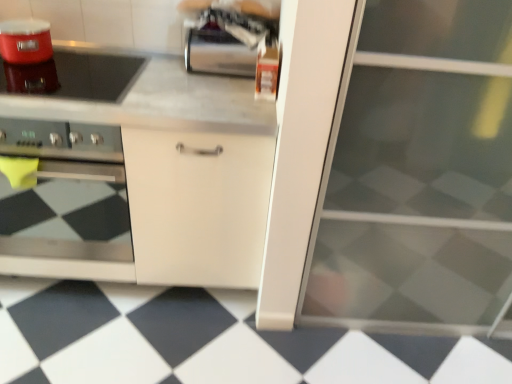
Question: In terms of width, does matte red rice cooker at upper left look wider or thinner when compared to satin metallic paper towel holder at upper center?

Choices:
 (A) thin
 (B) wide

Answer: (B)

Question: In terms of height, does matte red rice cooker at upper left look taller or shorter compared to satin metallic paper towel holder at upper center?

Choices:
 (A) tall
 (B) short

Answer: (B)

Question: Estimate the real-world distances between objects in this image. Which object is closer to the matte red rice cooker at upper left?

Choices:
 (A) black glossy tile at lower center
 (B) shiny black glass at upper left
 (C) transparent glass screen door at right
 (D) satin metallic paper towel holder at upper center
 (E) stainless steel oven at left

Answer: (B)

Question: Considering the real-world distances, which object is closest to the shiny black glass at upper left?

Choices:
 (A) matte red rice cooker at upper left
 (B) stainless steel oven at left
 (C) satin metallic paper towel holder at upper center
 (D) transparent glass screen door at right
 (E) black glossy tile at lower center

Answer: (A)